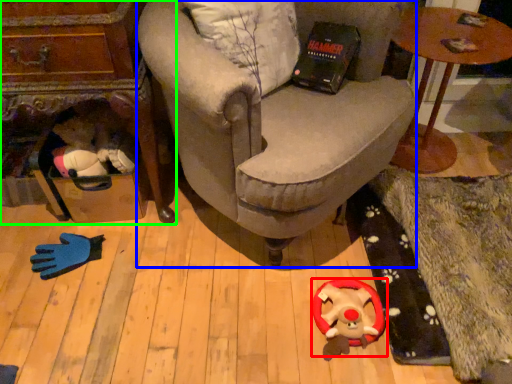
Question: Which is farther away from toy (highlighted by a red box)? chair (highlighted by a blue box) or table (highlighted by a green box)?

Choices:
 (A) chair
 (B) table

Answer: (B)